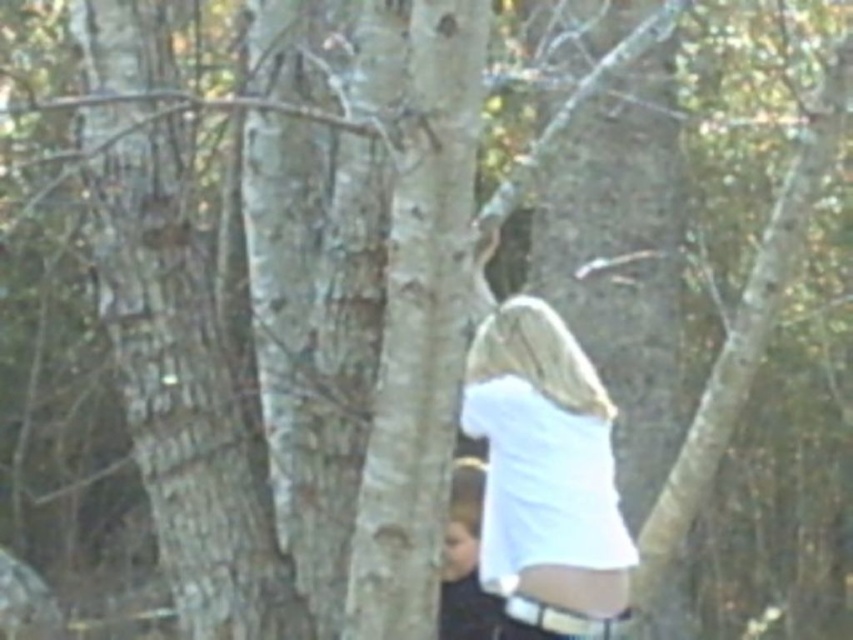
Who is more forward, [106,148] or [447,614]?

Point [106,148] is in front.

Measure the distance between white smooth tree trunk at center and camera.

white smooth tree trunk at center is 9.37 feet away from camera.

This screenshot has height=640, width=853. I want to click on white smooth tree trunk at center, so click(x=181, y=333).

Can you confirm if white smooth tree trunk at center is positioned to the right of white matte shirt at center?

No, white smooth tree trunk at center is not to the right of white matte shirt at center.

Who is positioned more to the left, white smooth tree trunk at center or white matte shirt at center?

Positioned to the left is white smooth tree trunk at center.

Image resolution: width=853 pixels, height=640 pixels. Describe the element at coordinates (181, 333) in the screenshot. I see `white smooth tree trunk at center` at that location.

Where is `white smooth tree trunk at center`? The width and height of the screenshot is (853, 640). white smooth tree trunk at center is located at coordinates (181, 333).

From the picture: Is white matte shirt at center behind white fabric at lower right?

No, it is not.

Does white matte shirt at center appear on the right side of white fabric at lower right?

Indeed, white matte shirt at center is positioned on the right side of white fabric at lower right.

Between point (587, 486) and point (456, 518), which one is positioned behind?

The point (456, 518) is behind.

The height and width of the screenshot is (640, 853). Find the location of `white matte shirt at center`. white matte shirt at center is located at coordinates 544,476.